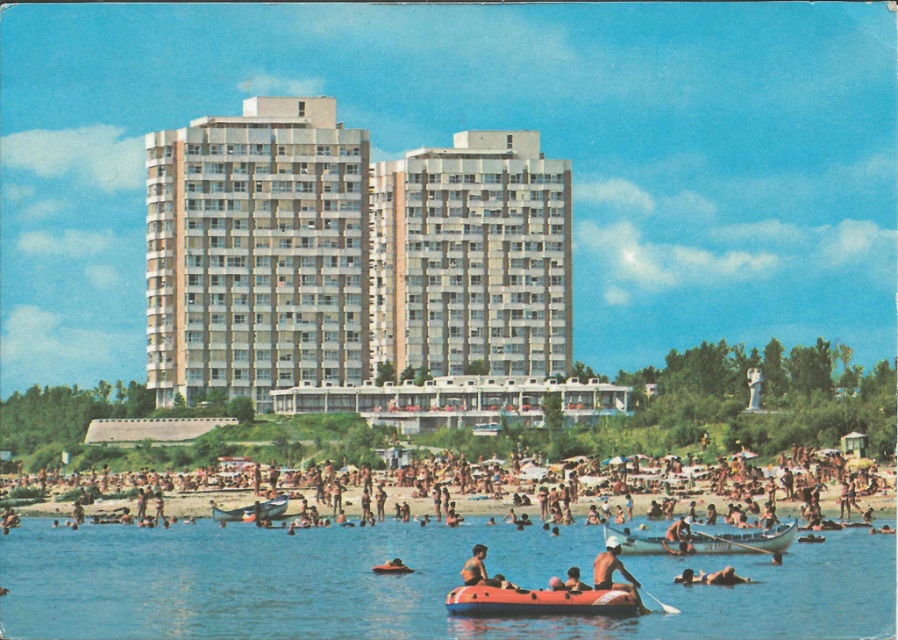
Does beige sand beachgoer at lower center have a smaller size compared to smooth orange lifebuoy at center?

Incorrect, beige sand beachgoer at lower center is not smaller in size than smooth orange lifebuoy at center.

Can you confirm if beige sand beachgoer at lower center is bigger than smooth orange lifebuoy at center?

Correct, beige sand beachgoer at lower center is larger in size than smooth orange lifebuoy at center.

Where is `beige sand beachgoer at lower center`? This screenshot has width=898, height=640. beige sand beachgoer at lower center is located at coordinates (465, 488).

Locate an element on the screen. beige sand beachgoer at lower center is located at coordinates (465, 488).

Which of these two, orange rubber raft at center or smooth skin person at lower center, stands taller?

smooth skin person at lower center

Is point (622, 593) more distant than point (676, 552)?

No, (622, 593) is closer to viewer.

I want to click on orange rubber raft at center, so click(538, 602).

Looking at this image, can you confirm if beige concrete building at center is positioned below translucent blue water at lower center?

Incorrect, beige concrete building at center is not positioned below translucent blue water at lower center.

Which is behind, point (377, 260) or point (86, 538)?

Positioned behind is point (377, 260).

Is point (216, 365) closer to camera compared to point (427, 600)?

No.

Find the location of `beige concrete building at center`. beige concrete building at center is located at coordinates (348, 253).